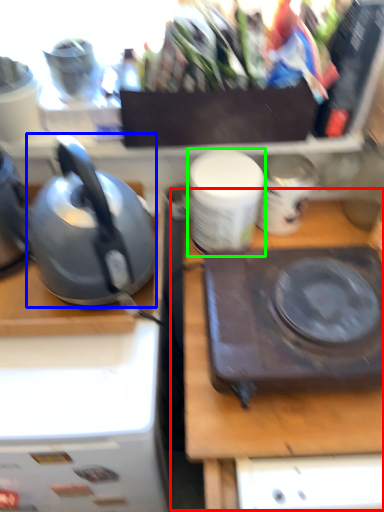
Question: Based on their relative distances, which object is nearer to table (highlighted by a red box)? Choose from kettle (highlighted by a blue box) and tableware (highlighted by a green box).

Choices:
 (A) kettle
 (B) tableware

Answer: (B)